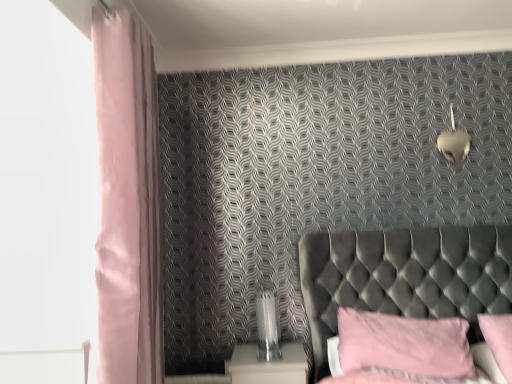
Question: Does metallic heart-shaped light fixture at upper right turn towards pink fabric pillow at lower right, acting as the 1th pillow starting from the left?

Choices:
 (A) yes
 (B) no

Answer: (B)

Question: Are metallic heart-shaped light fixture at upper right and pink fabric pillow at lower right, the second pillow viewed from the right, far apart?

Choices:
 (A) no
 (B) yes

Answer: (B)

Question: Is metallic heart-shaped light fixture at upper right facing away from pink fabric pillow at lower right, acting as the 1th pillow starting from the left?

Choices:
 (A) no
 (B) yes

Answer: (A)

Question: Is metallic heart-shaped light fixture at upper right located outside pink fabric pillow at lower right, the second pillow viewed from the right?

Choices:
 (A) no
 (B) yes

Answer: (B)

Question: Would you say pink fabric pillow at lower right, the second pillow viewed from the right, is part of metallic heart-shaped light fixture at upper right's contents?

Choices:
 (A) yes
 (B) no

Answer: (B)

Question: From the image's perspective, is metallic heart-shaped light fixture at upper right under pink fabric pillow at lower right, acting as the 1th pillow starting from the left?

Choices:
 (A) yes
 (B) no

Answer: (B)

Question: Is tufted velvet headboard at right looking in the opposite direction of metallic heart-shaped light fixture at upper right?

Choices:
 (A) no
 (B) yes

Answer: (A)

Question: Is tufted velvet headboard at right next to metallic heart-shaped light fixture at upper right?

Choices:
 (A) no
 (B) yes

Answer: (A)

Question: From a real-world perspective, does tufted velvet headboard at right stand above metallic heart-shaped light fixture at upper right?

Choices:
 (A) no
 (B) yes

Answer: (A)

Question: Can you confirm if tufted velvet headboard at right is smaller than metallic heart-shaped light fixture at upper right?

Choices:
 (A) yes
 (B) no

Answer: (B)

Question: Does tufted velvet headboard at right appear on the right side of metallic heart-shaped light fixture at upper right?

Choices:
 (A) yes
 (B) no

Answer: (B)

Question: Is tufted velvet headboard at right bigger than metallic heart-shaped light fixture at upper right?

Choices:
 (A) yes
 (B) no

Answer: (A)

Question: Is pink fabric pillow at lower right, marked as the 1th pillow in a right-to-left arrangement, outside of pink fabric pillow at lower right, acting as the 1th pillow starting from the left?

Choices:
 (A) yes
 (B) no

Answer: (A)